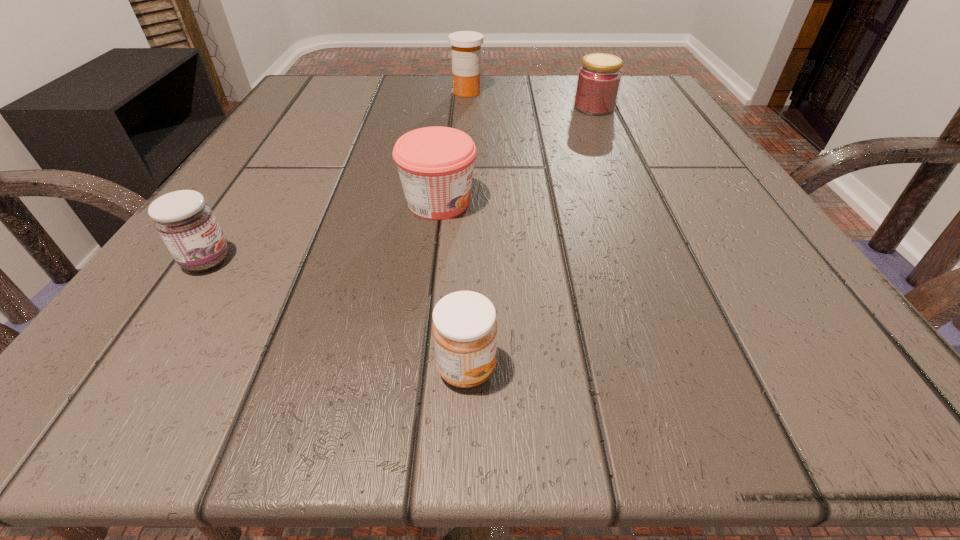
This screenshot has height=540, width=960. What are the coordinates of `free point located on the front of the farthest jam` in the screenshot? It's located at (619, 165).

What are the coordinates of `vacant area situated on the front label of the second nearest jam` in the screenshot? It's located at (466, 260).

Where is `free space located 0.140m on the front label of the nearest jam`? The height and width of the screenshot is (540, 960). free space located 0.140m on the front label of the nearest jam is located at coordinates (639, 369).

At what (x,y) coordinates should I click in order to perform the action: click on medicine that is at the far edge. Please return your answer as a coordinate pair (x, y). Looking at the image, I should click on (465, 45).

At what (x,y) coordinates should I click in order to perform the action: click on jam that is at the far edge. Please return your answer as a coordinate pair (x, y). Looking at the image, I should click on (599, 78).

You are a GUI agent. You are given a task and a screenshot of the screen. Output one action in this format:
    pyautogui.click(x=<x>, y=<y>)
    Task: Click on the object situated at the near edge
    
    Given the screenshot: What is the action you would take?
    pyautogui.click(x=464, y=327)

Find the location of a particular element. object that is positioned at the left edge is located at coordinates (187, 225).

At what (x,y) coordinates should I click in order to perform the action: click on object that is at the right edge. Please return your answer as a coordinate pair (x, y). This screenshot has height=540, width=960. Looking at the image, I should click on (599, 78).

Locate an element on the screen. The image size is (960, 540). object located at the far right corner is located at coordinates (599, 78).

The width and height of the screenshot is (960, 540). In the image, there is a desktop. What are the coordinates of `free space at the far edge` in the screenshot? It's located at (411, 121).